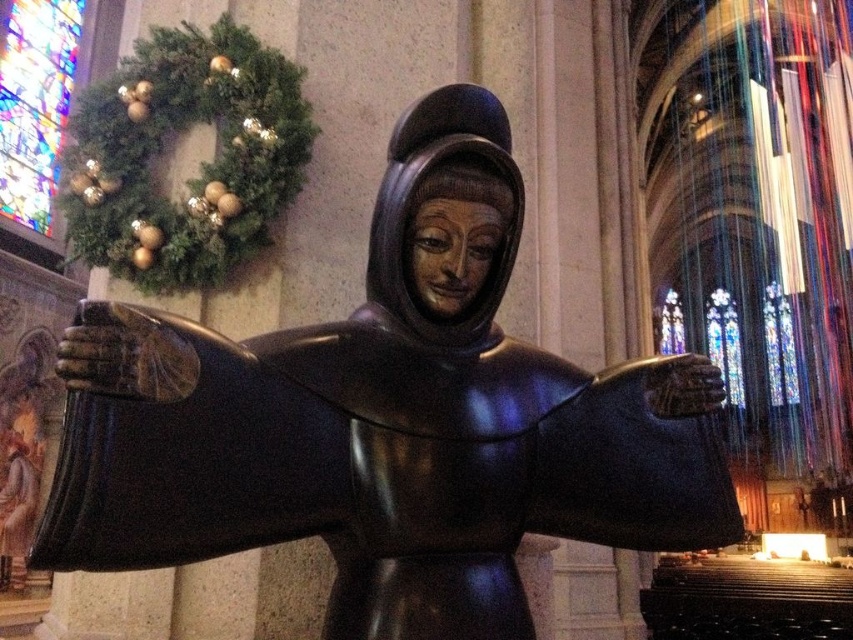
You are standing in the cathedral and want to take a photo of both the shiny bronze statue at center and the stained glass window at upper right in the same frame. Based on their positions, can you tell me which object is closer to the left side of the image?

The shiny bronze statue at center is to the left of the stained glass window at upper right, so the shiny bronze statue at center is closer to the left side of the image.